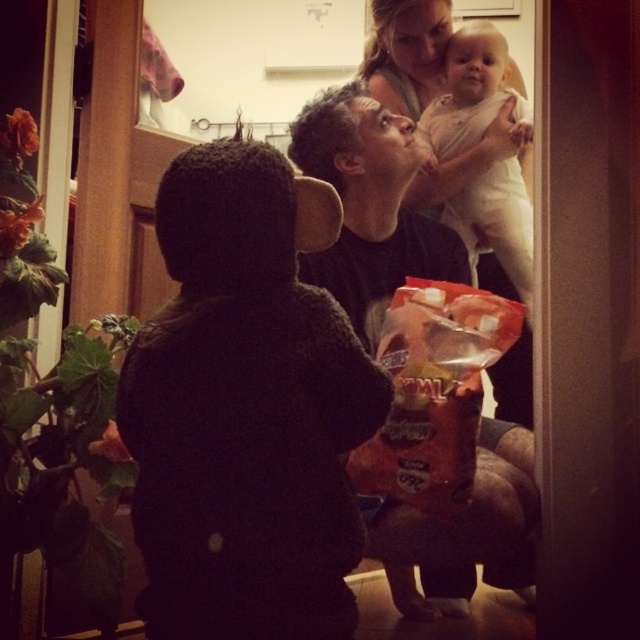
You are a photographer trying to capture a clear photo of the white cloth baby at upper center. However, there is a matte black shirt at center blocking your view. Can you adjust your position to see the baby?

The matte black shirt at center is in front of the white cloth baby at upper center, so moving your position to the side or angle your camera might allow you to see around the shirt and capture the baby.

You are a photographer setting up a photo shoot in this scene. You need to place a small prop between the matte black shirt at center and the white cloth baby at upper center. Given their sizes, which object should the prop be closer to?

The matte black shirt at center is larger in size than the white cloth baby at upper center, so the prop should be placed closer to the white cloth baby at upper center to balance the composition.

You are trying to decide which item is wider between the matte black shirt at center and the white cloth baby at upper center. Based on the scene description, which one is wider?

The matte black shirt at center is wider than the white cloth baby at upper center according to the description.